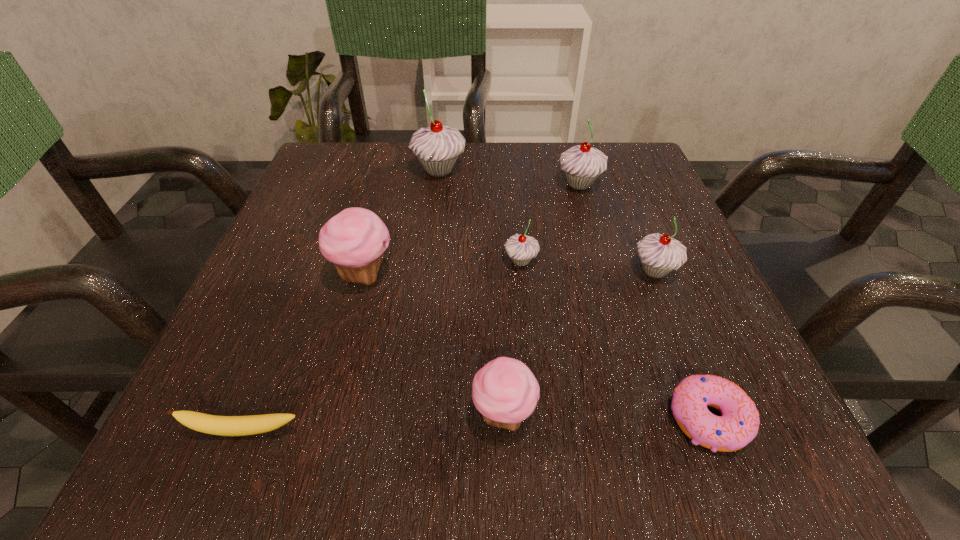
Identify the location of vacant space in between the farther pink cupcake and the second tallest cupcake. The image size is (960, 540). (471, 229).

You are a GUI agent. You are given a task and a screenshot of the screen. Output one action in this format:
    pyautogui.click(x=<x>, y=<y>)
    Task: Click on the free area in between the bigger pink cupcake and the smaller pink cupcake
    
    Given the screenshot: What is the action you would take?
    pyautogui.click(x=434, y=344)

The width and height of the screenshot is (960, 540). I want to click on free space between the nearer pink cupcake and the rightmost gray cupcake, so click(x=579, y=342).

The width and height of the screenshot is (960, 540). Identify the location of free spot between the farther pink cupcake and the second gray cupcake from left to right. (443, 267).

This screenshot has height=540, width=960. Identify the location of object that ranks as the fifth closest to the smallest gray cupcake. (505, 391).

This screenshot has width=960, height=540. Find the location of `the seventh closest object to the rightmost gray cupcake`. the seventh closest object to the rightmost gray cupcake is located at coordinates (211, 424).

Where is `cupcake that can be found as the second closest to the nearest cupcake`? This screenshot has width=960, height=540. cupcake that can be found as the second closest to the nearest cupcake is located at coordinates (521, 249).

Identify which cupcake is the second closest to the bigger pink cupcake. Please provide its 2D coordinates. Your answer should be formatted as a tuple, i.e. [(x, y)], where the tuple contains the x and y coordinates of a point satisfying the conditions above.

[(505, 391)]

Identify which gray cupcake is the second closest to the doughnut. Please provide its 2D coordinates. Your answer should be formatted as a tuple, i.e. [(x, y)], where the tuple contains the x and y coordinates of a point satisfying the conditions above.

[(521, 249)]

Find the location of a particular element. This screenshot has width=960, height=540. gray cupcake that stands as the second closest to the doughnut is located at coordinates (521, 249).